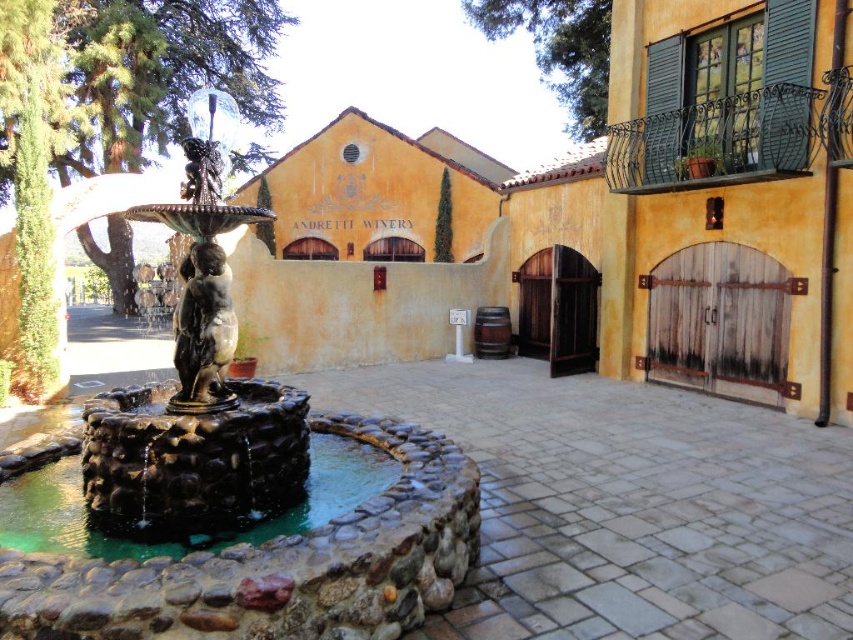
You are standing at the entrance of Andretti Winery and want to take a photo of the polished bronze statue at center. If your camera has a maximum focus range of 4 meters, will you need to move closer to capture a clear image?

The polished bronze statue at center is 4.28 meters away from the camera. Since the maximum focus range is 4 meters, you need to move closer to ensure the statue is in focus.

You are standing at the entrance of Andretti Winery and want to take a photo of two specific points in the scene. The first point is at coordinate point (306,506) and the second is at point (192,260). Which point will appear larger in your camera view?

Point (306,506) is closer to the viewer than point (192,260), so it will appear larger in the camera view.